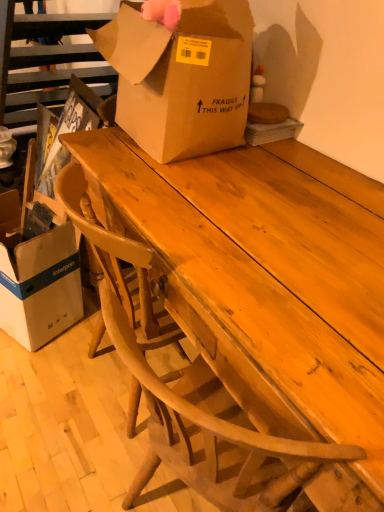
Question: Is point (38, 253) positioned closer to the camera than point (150, 115)?

Choices:
 (A) farther
 (B) closer

Answer: (A)

Question: Is white cardboard box at lower left, which ranks as the first box in bottom-to-top order, situated inside brown cardboard box at center, which ranks as the 2th box in left-to-right order, or outside?

Choices:
 (A) inside
 (B) outside

Answer: (B)

Question: Based on their relative distances, which object is farther from the wooden table at center?

Choices:
 (A) brown cardboard box at center, the 2th box ordered from the bottom
 (B) white cardboard box at lower left, the first box positioned from the left

Answer: (B)

Question: Which object is positioned farthest from the brown cardboard box at center, the 2th box ordered from the bottom?

Choices:
 (A) wooden table at center
 (B) white cardboard box at lower left, which ranks as the first box in bottom-to-top order

Answer: (B)